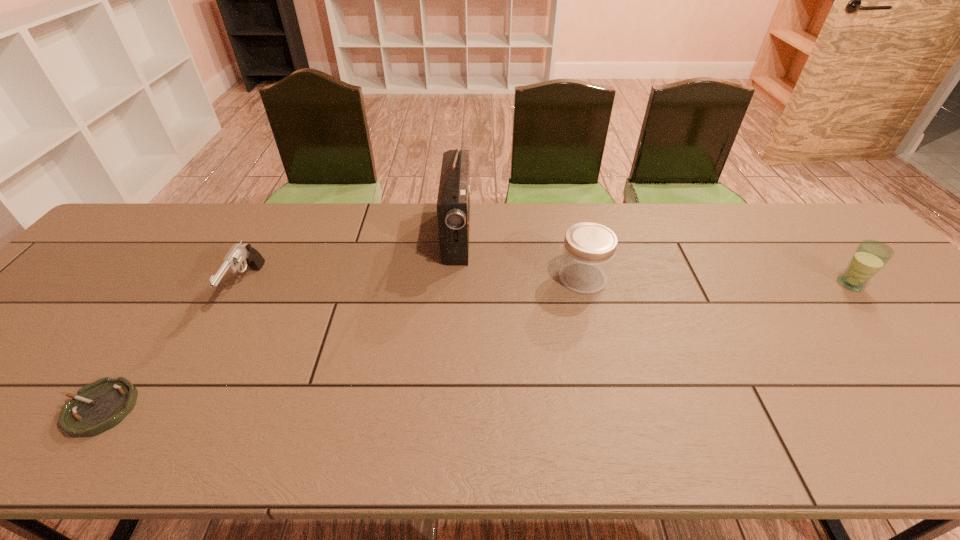
Locate an element on the screen. vacant space situated 0.170m on the left of the glass is located at coordinates (773, 284).

This screenshot has width=960, height=540. I want to click on vacant space situated 0.050m on the right of the ashtray, so click(158, 408).

Locate an element on the screen. The width and height of the screenshot is (960, 540). object that is at the far edge is located at coordinates (453, 203).

Locate an element on the screen. The height and width of the screenshot is (540, 960). object at the near edge is located at coordinates [x=99, y=406].

The width and height of the screenshot is (960, 540). Identify the location of object located in the right edge section of the desktop. (870, 256).

In the image, there is a desktop. Where is `free region at the far edge`? This screenshot has height=540, width=960. free region at the far edge is located at coordinates (492, 204).

The height and width of the screenshot is (540, 960). Find the location of `free spot at the near edge of the desktop`. free spot at the near edge of the desktop is located at coordinates (18, 417).

This screenshot has height=540, width=960. I want to click on free space at the left edge of the desktop, so click(100, 291).

The height and width of the screenshot is (540, 960). I want to click on free space at the far left corner of the desktop, so (128, 244).

In the image, there is a desktop. At what (x,y) coordinates should I click in order to perform the action: click on free region at the far right corner. Please return your answer as a coordinate pair (x, y). The width and height of the screenshot is (960, 540). Looking at the image, I should click on coord(831,232).